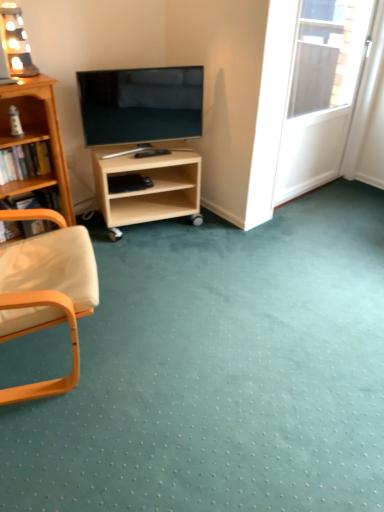
The image size is (384, 512). I want to click on vacant space underneath wooden armchair at left (from a real-world perspective), so click(62, 351).